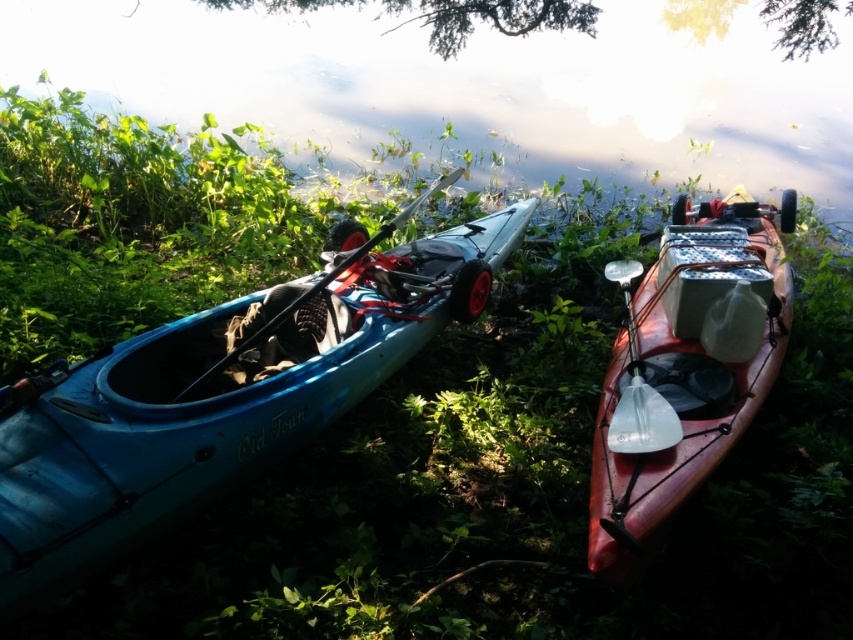
You are standing on the grassy riverbank and want to take a closer look at both the blue plastic kayak at left and the matte red kayak at center. Which kayak will appear closer to you when you first arrive at the scene?

The blue plastic kayak at left will appear closer to you because it is positioned in front of the matte red kayak at center.

You are planning to take a photo of the green leafy tree at upper center and the matte black paddle at center. Which object will appear taller in the photo?

The matte black paddle at center will appear taller in the photo because the green leafy tree at upper center is not as tall as the matte black paddle at center.

You are standing near the kayaks and want to pick up an item from the ground between you and the blue plastic kayak at left. Can you comfortably reach it without moving your feet?

The blue plastic kayak at left is 1.57 meters away from you, so you might not be able to comfortably reach it without moving your feet since the distance is quite far.